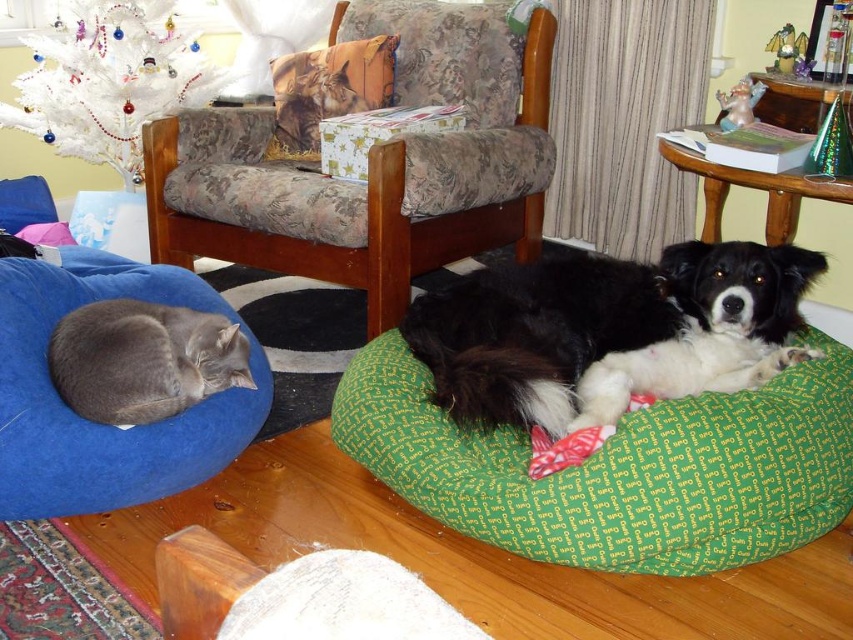
Question: Observing the image, what is the correct spatial positioning of velvet floral-patterned bean bag chair at center in reference to black soft dog at center?

Choices:
 (A) right
 (B) left

Answer: (B)

Question: Can you confirm if green fabric dog bed at lower right is wider than gray plush cat at left?

Choices:
 (A) no
 (B) yes

Answer: (B)

Question: Which object is the farthest from the green fabric dog bed at lower right?

Choices:
 (A) gray plush cat at left
 (B) black soft dog at center

Answer: (A)

Question: Which is farther from the gray plush cat at left?

Choices:
 (A) velvet floral-patterned bean bag chair at center
 (B) printed fabric pillow at upper center
 (C) black soft dog at center

Answer: (B)

Question: Can you confirm if green fabric dog bed at lower right is wider than gray plush cat at left?

Choices:
 (A) yes
 (B) no

Answer: (A)

Question: Which object appears closest to the camera in this image?

Choices:
 (A) velvet floral-patterned bean bag chair at center
 (B) gray plush cat at left
 (C) printed fabric pillow at upper center

Answer: (B)